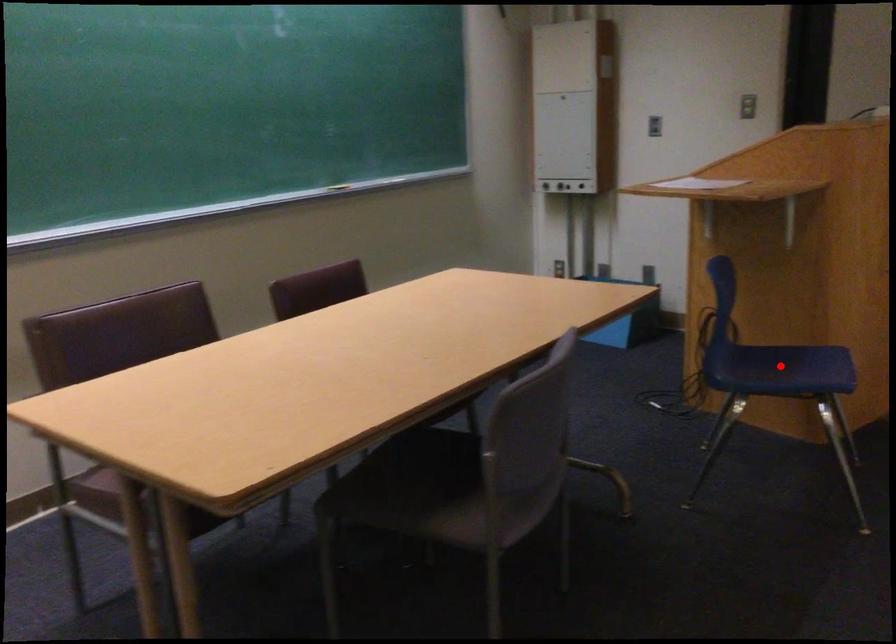
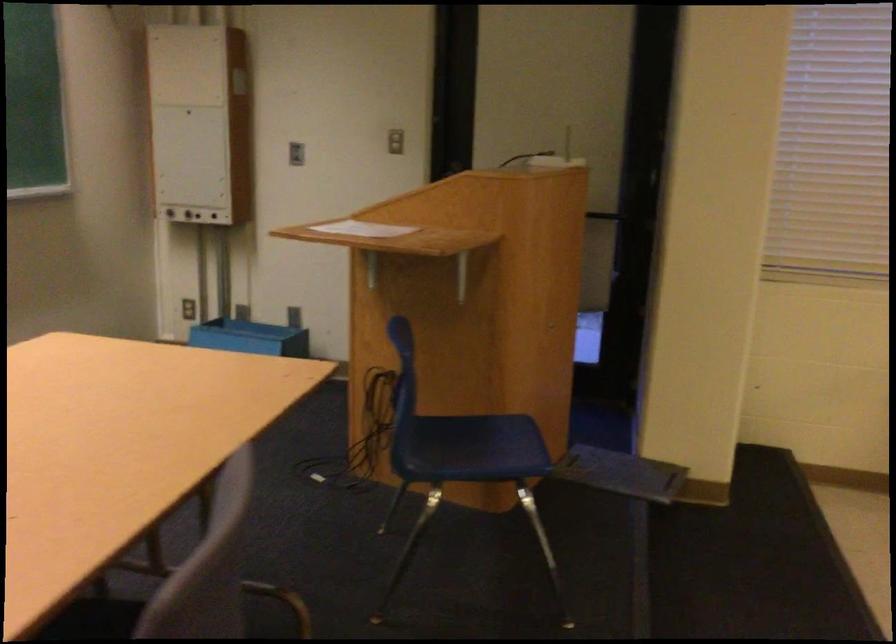
Question: A red point is marked in image1. In image2, is the corresponding 3D point closer to the camera or farther? Reply with the corresponding letter.

Choices:
 (A) The corresponding 3D point is closer.
 (B) The corresponding 3D point is farther.

Answer: (A)